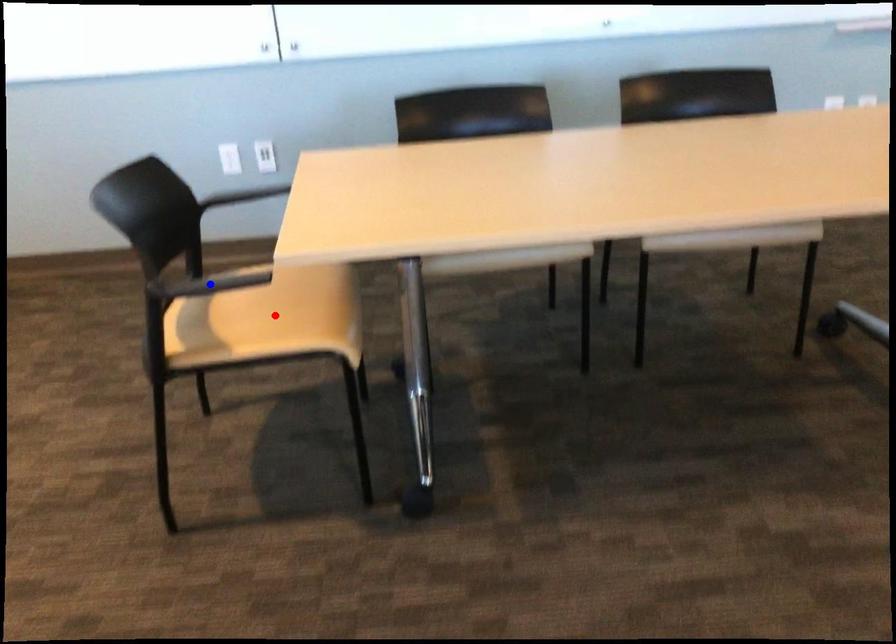
Question: In the image, two points are highlighted. Which point is nearer to the camera? Reply with the corresponding letter.

Choices:
 (A) blue point
 (B) red point

Answer: (A)